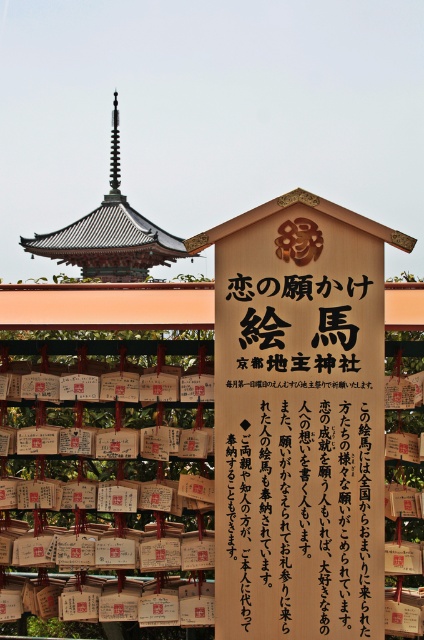
Question: Is wooden sign at center smaller than dark brown wooden pagoda at upper center?

Choices:
 (A) no
 (B) yes

Answer: (B)

Question: Which object is closer to the camera taking this photo?

Choices:
 (A) dark brown wooden pagoda at upper center
 (B) wooden sign at center

Answer: (B)

Question: Among these points, which one is nearest to the camera?

Choices:
 (A) (167, 248)
 (B) (262, 513)

Answer: (B)

Question: From the image, what is the correct spatial relationship of wooden sign at center in relation to dark brown wooden pagoda at upper center?

Choices:
 (A) below
 (B) above

Answer: (A)

Question: Which object appears closest to the camera in this image?

Choices:
 (A) wooden sign at center
 (B) dark brown wooden pagoda at upper center

Answer: (A)

Question: In this image, where is wooden sign at center located relative to dark brown wooden pagoda at upper center?

Choices:
 (A) right
 (B) left

Answer: (A)